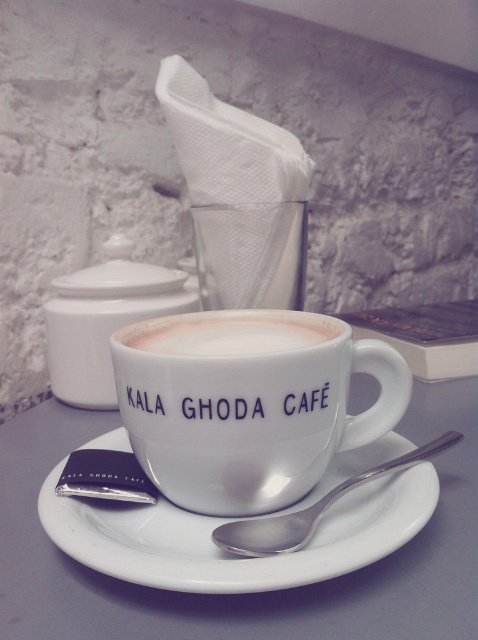
You are a barista preparing a coffee order. You need to place both the white ceramic saucer at center and the satin silver spoon at center onto a small tray that can only hold items of a certain size. Based on their sizes, which item should you place first to ensure they both fit?

The satin silver spoon at center is smaller than the white ceramic saucer at center. Therefore, you should place the satin silver spoon at center first, followed by the white ceramic saucer at center to ensure both fit on the tray.

You are a customer at KALA GHODA CAF and want to place your phone on the table without covering any items. The white ceramic cup at center is located at point (249,404). Where should you place your phone to avoid covering the cup?

Place your phone anywhere except the point (249,404) where the white ceramic cup at center is located.